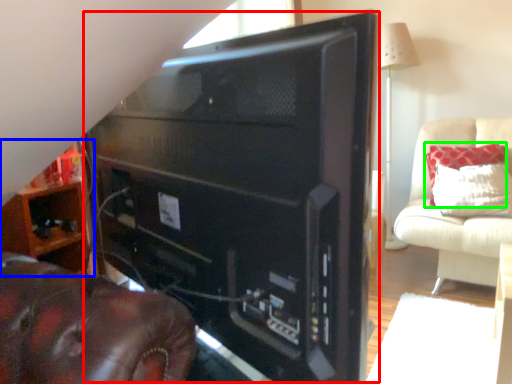
Question: Which object is positioned closest to desktop computer (highlighted by a red box)? Select from furniture (highlighted by a blue box) and pillow (highlighted by a green box).

Choices:
 (A) furniture
 (B) pillow

Answer: (A)